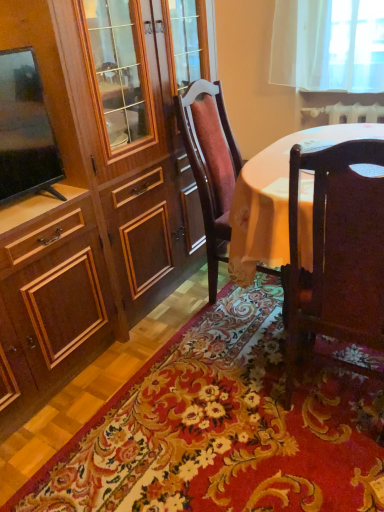
The width and height of the screenshot is (384, 512). I want to click on vacant area situated to the left side of wooden chair at center, which ranks as the 2th chair in front-to-back order, so click(172, 308).